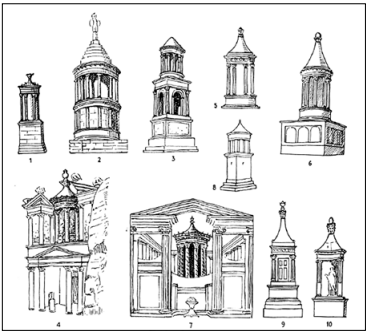
I want to click on archway, so click(175, 92), click(159, 93).